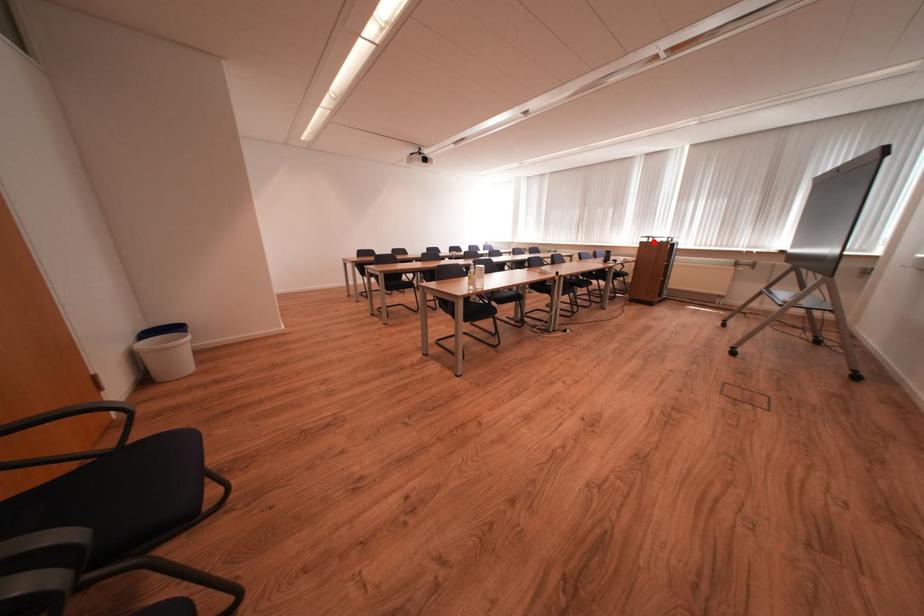
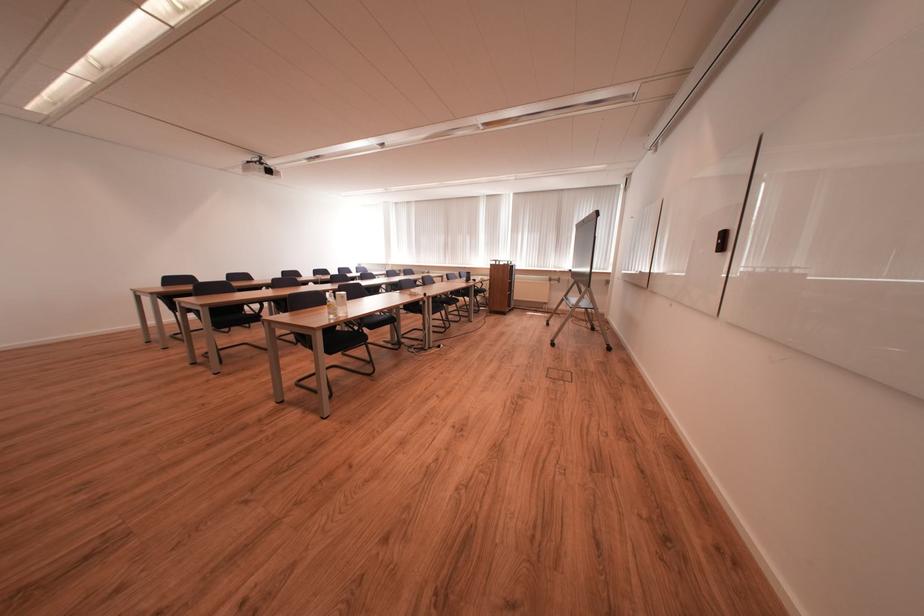
The point at the highlighted location is marked in the first image. Where is the corresponding point in the second image?

(503, 265)